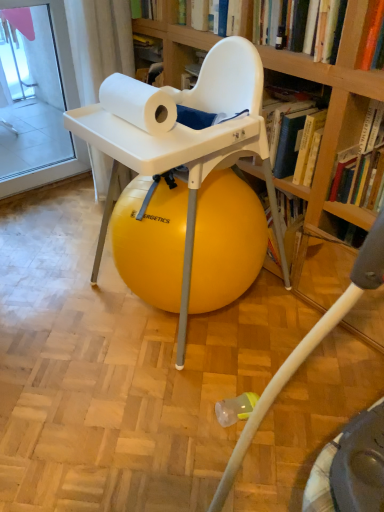
I want to click on free space to the left of yellow rubber ball at center, so click(57, 300).